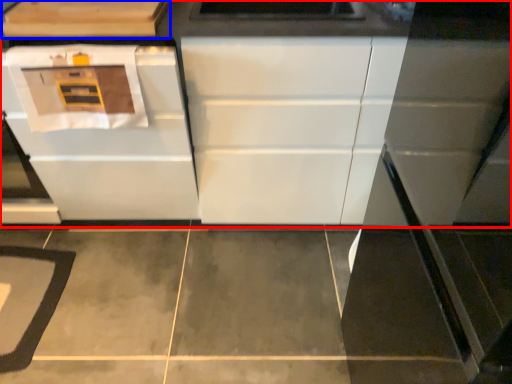
Question: Which object is further to the camera taking this photo, cabinetry (highlighted by a red box) or cabinetry (highlighted by a blue box)?

Choices:
 (A) cabinetry
 (B) cabinetry

Answer: (A)